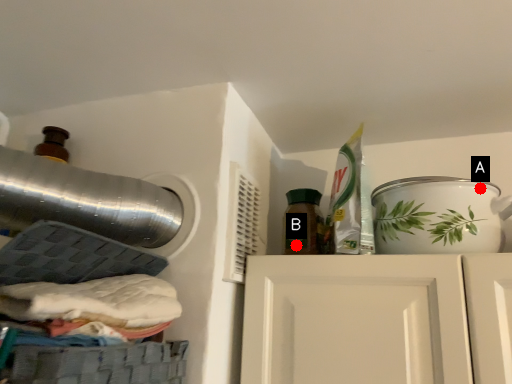
Question: Two points are circled on the image, labeled by A and B beside each circle. Which point is farther from the camera taking this photo?

Choices:
 (A) A is further
 (B) B is further

Answer: (B)